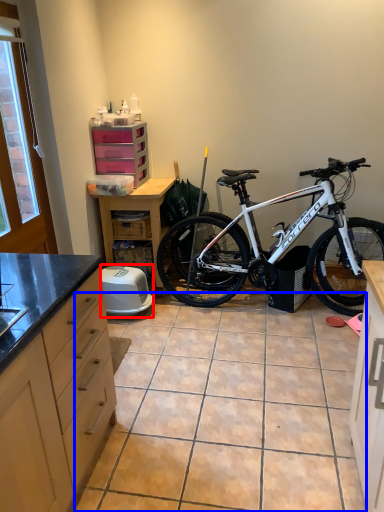
Question: Which object is closer to the camera taking this photo, appliance (highlighted by a red box) or tile (highlighted by a blue box)?

Choices:
 (A) appliance
 (B) tile

Answer: (B)